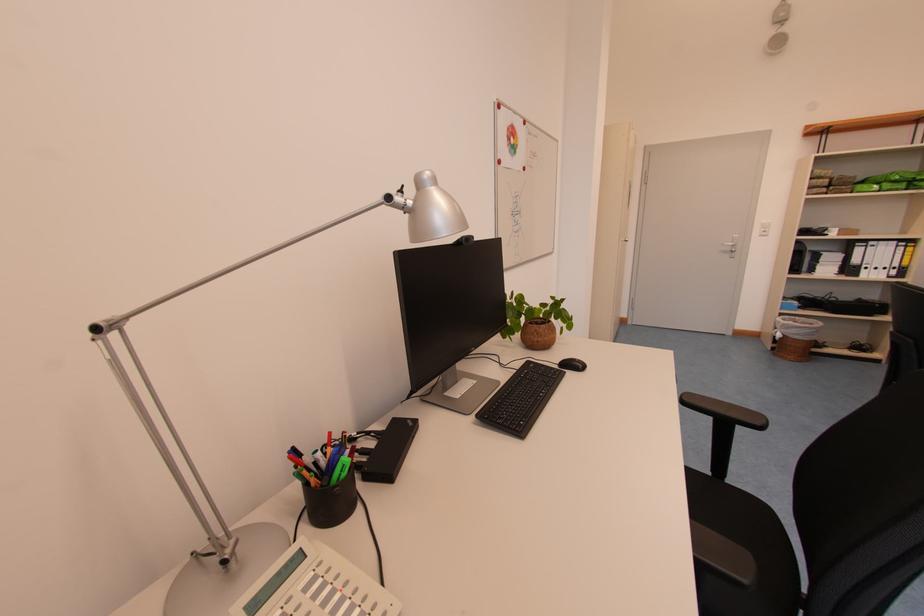
Describe the element at coordinates (743, 564) in the screenshot. I see `the chair sitting surface` at that location.